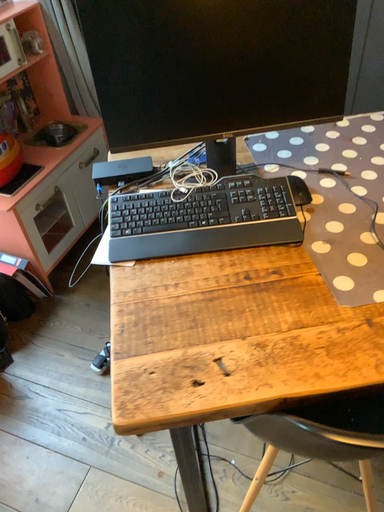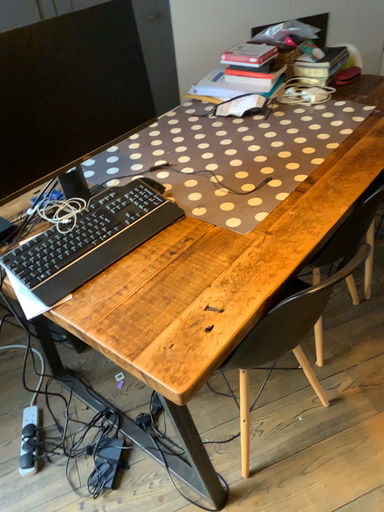
Question: How did the camera likely rotate when shooting the video?

Choices:
 (A) rotated downward
 (B) rotated upward

Answer: (B)